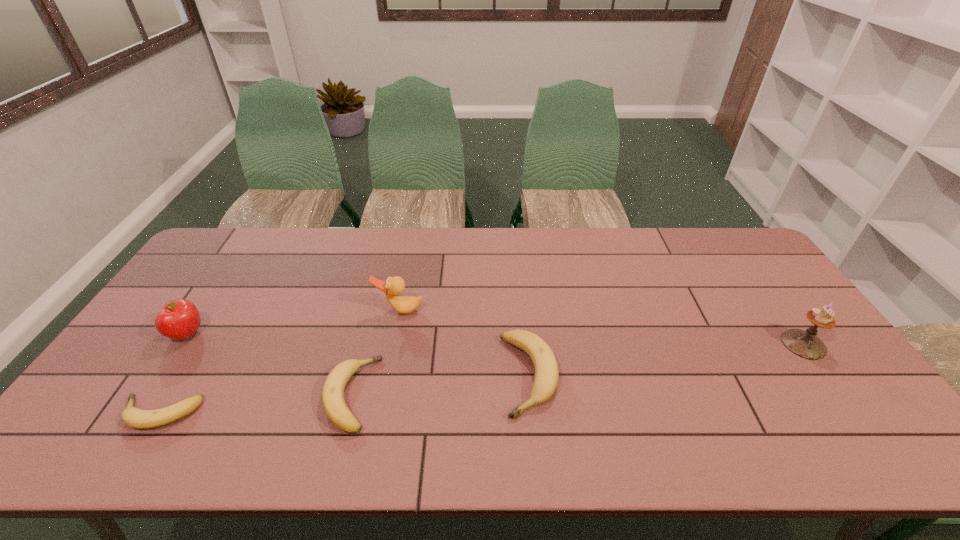
At what (x,y) coordinates should I click in order to perform the action: click on vacant space at the near edge of the desktop. Please return your answer as a coordinate pair (x, y). Looking at the image, I should click on (297, 393).

In the image, there is a desktop. Where is `free region at the right edge`? This screenshot has width=960, height=540. free region at the right edge is located at coordinates (780, 348).

The image size is (960, 540). I want to click on blank space at the far left corner of the desktop, so [x=245, y=252].

Locate an element on the screen. The height and width of the screenshot is (540, 960). free region at the far right corner is located at coordinates (758, 258).

In the image, there is a desktop. At what (x,y) coordinates should I click in order to perform the action: click on free space at the near right corner. Please return your answer as a coordinate pair (x, y). Looking at the image, I should click on (827, 418).

At what (x,y) coordinates should I click in order to perform the action: click on empty space that is in between the apple and the farthest object. Please return your answer as a coordinate pair (x, y). The image size is (960, 540). Looking at the image, I should click on (294, 322).

Identify the location of vacant area that lies between the duck and the tallest object. The height and width of the screenshot is (540, 960). (602, 327).

This screenshot has height=540, width=960. In order to click on free space between the rightmost banana and the farthest object in this screenshot , I will do `click(465, 342)`.

This screenshot has height=540, width=960. Identify the location of empty space that is in between the second banana from left to right and the fifth object from left to right. (440, 384).

This screenshot has height=540, width=960. I want to click on empty space that is in between the apple and the fifth tallest object, so click(269, 364).